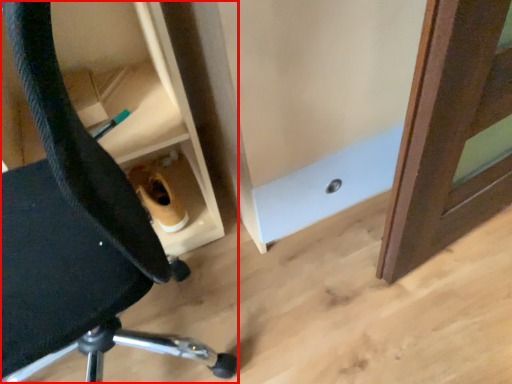
Question: From the image's perspective, where is chair (annotated by the red box) located relative to cabinetry?

Choices:
 (A) below
 (B) above

Answer: (A)